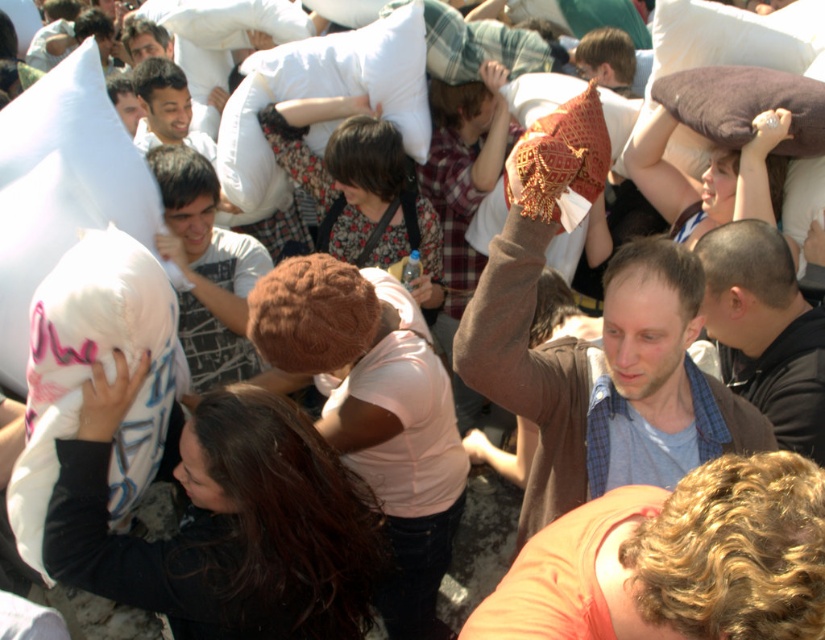
You are a photographer at the pillow fight event. You want to capture a photo of the brown textured sweater at upper right and another participant holding a white pillow. How far apart are these two subjects?

The brown textured sweater at upper right and the other participant holding a white pillow are 8.16 feet apart.

You are a photographer at the event and want to capture a photo of both the brown textured sweater at upper right and the dark gray jacket at center in the same frame. Which clothing item should you focus on first to ensure both are in the frame?

The brown textured sweater at upper right is taller than the dark gray jacket at center, so you should focus on the brown textured sweater at upper right first to ensure both are in the frame.

You are organizing a photo shoot and need to arrange participants in a line. The brown textured sweater at upper right and the dark gray jacket at center must be positioned side by side. Which participant should stand to the left to ensure their clothing items do not overlap?

The brown textured sweater at upper right should stand to the left since it is wider than the dark gray jacket at center, preventing overlap when placed side by side.